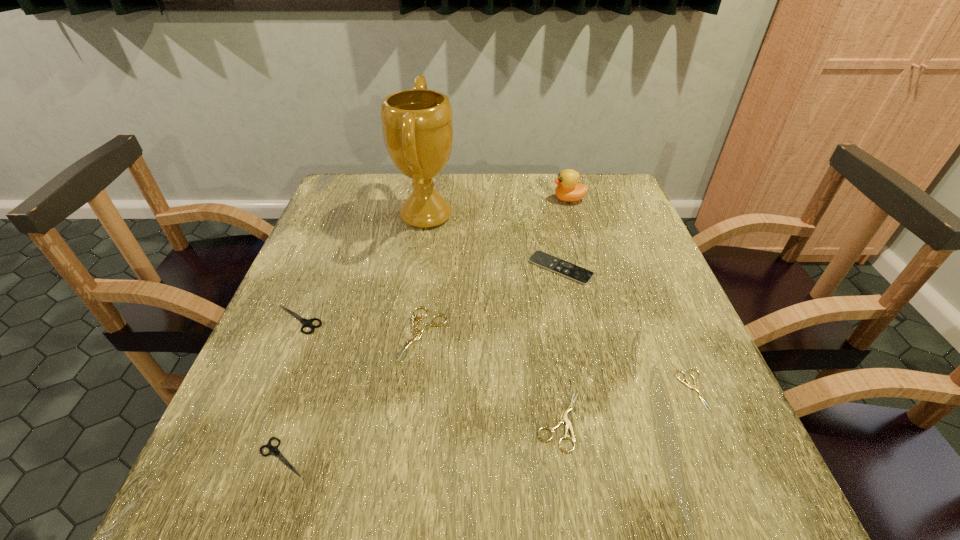
Where is `beige shears that is the second closest to the duckling`? The image size is (960, 540). beige shears that is the second closest to the duckling is located at coordinates (695, 387).

At what (x,y) coordinates should I click in order to perform the action: click on free space that satisfies the following two spatial constraints: 1. on the front of the tallest object with the decoration; 2. on the back side of the shortest shears. Please return your answer as a coordinate pair (x, y). Looking at the image, I should click on (398, 390).

The height and width of the screenshot is (540, 960). Find the location of `free space that satisfies the following two spatial constraints: 1. on the back side of the remote control; 2. on the right side of the farther black shears`. free space that satisfies the following two spatial constraints: 1. on the back side of the remote control; 2. on the right side of the farther black shears is located at coordinates (320, 268).

The image size is (960, 540). Identify the location of vacant position in the image that satisfies the following two spatial constraints: 1. on the front of the leftmost beige shears with the decoration; 2. on the right side of the award. (407, 334).

I want to click on vacant space that satisfies the following two spatial constraints: 1. on the back side of the nearer black shears; 2. on the right side of the second shears from right to left, so click(295, 420).